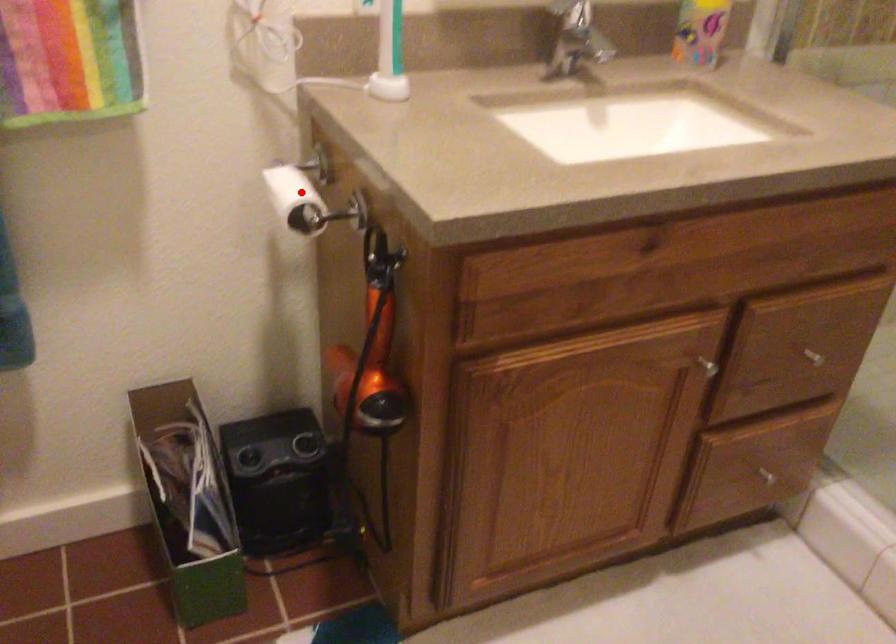
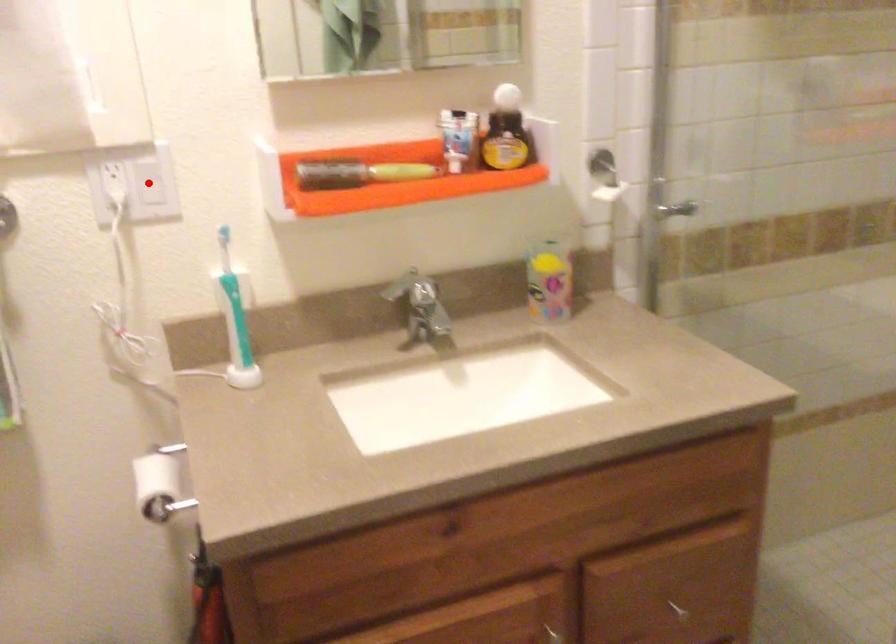
I am providing you with two images of the same scene from different viewpoints. A red point is marked on the first image and another point is marked on the second image. Is the marked point in image1 the same physical position as the marked point in image2?

No